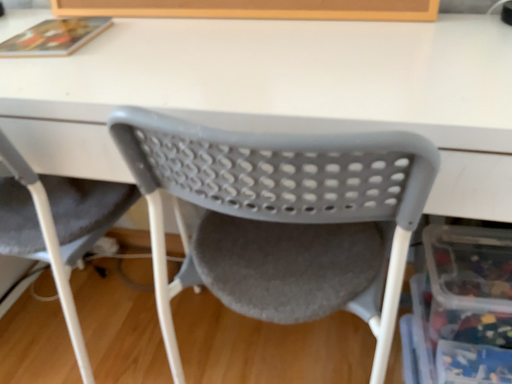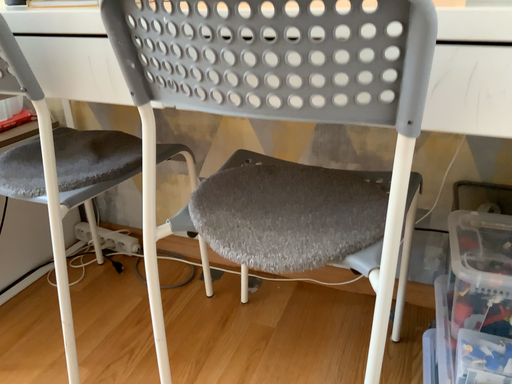
Question: How did the camera likely rotate when shooting the video?

Choices:
 (A) rotated upward
 (B) rotated downward

Answer: (A)